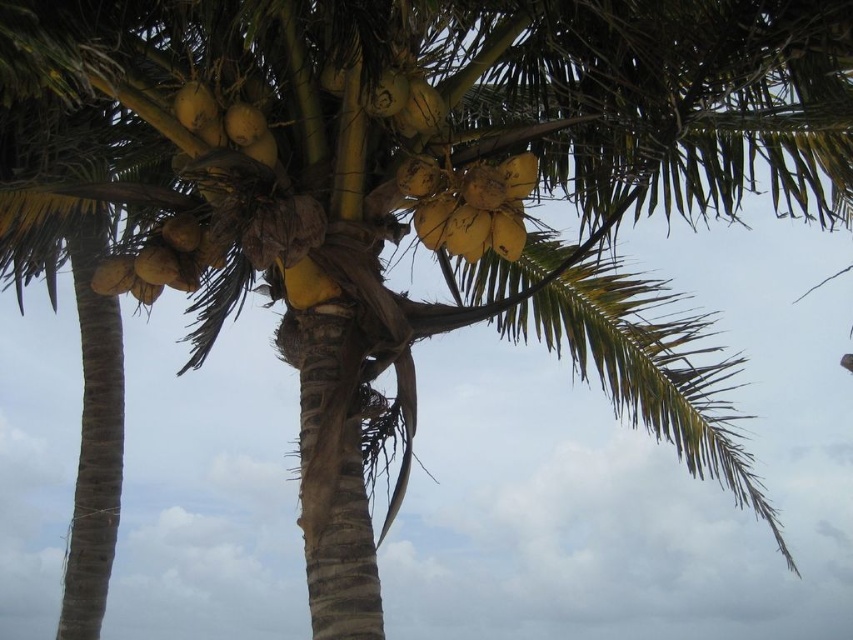
Question: Which of the following is the farthest from the observer?

Choices:
 (A) (173, 237)
 (B) (447, 205)

Answer: (A)

Question: Can you confirm if yellow matte coconut at upper center is positioned below yellow matte coconuts at center?

Choices:
 (A) no
 (B) yes

Answer: (A)

Question: From the image, what is the correct spatial relationship of yellow matte coconut at upper center in relation to yellow matte coconuts at center?

Choices:
 (A) right
 (B) left

Answer: (A)

Question: Does yellow matte coconut at upper center have a lesser width compared to yellow matte coconuts at center?

Choices:
 (A) no
 (B) yes

Answer: (B)